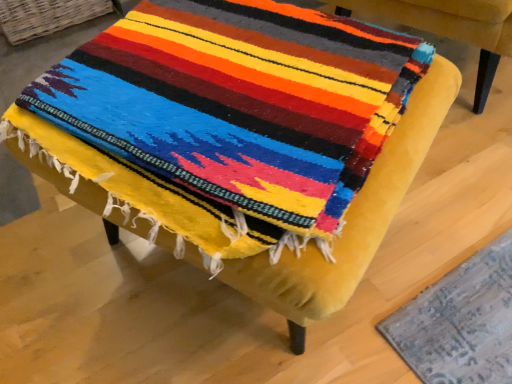
You are a GUI agent. You are given a task and a screenshot of the screen. Output one action in this format:
    pyautogui.click(x=<x>, y=<y>)
    Task: Click on the woven straw basket at upper left
    Image resolution: width=512 pixels, height=384 pixels.
    Given the screenshot: What is the action you would take?
    pyautogui.click(x=46, y=16)

Describe the element at coordinates (46, 16) in the screenshot. I see `woven straw basket at upper left` at that location.

Looking at this image, measure the distance between woven straw basket at upper left and camera.

A distance of 5.62 feet exists between woven straw basket at upper left and camera.

The height and width of the screenshot is (384, 512). I want to click on woven straw basket at upper left, so click(x=46, y=16).